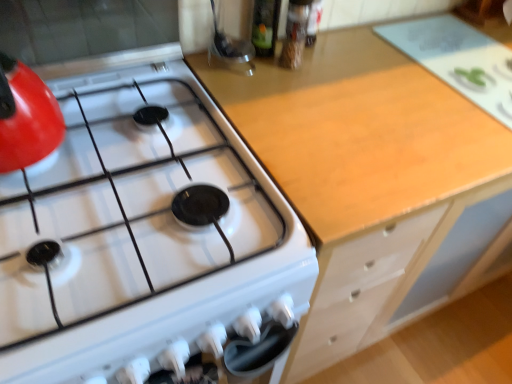
The height and width of the screenshot is (384, 512). What do you see at coordinates (373, 183) in the screenshot?
I see `light wood cabinet at center` at bounding box center [373, 183].

This screenshot has width=512, height=384. In order to click on light wood cabinet at center in this screenshot , I will do 373,183.

Locate an element on the screen. white glossy gas stove at upper left is located at coordinates [x=136, y=232].

This screenshot has height=384, width=512. Describe the element at coordinates (136, 232) in the screenshot. I see `white glossy gas stove at upper left` at that location.

Image resolution: width=512 pixels, height=384 pixels. Identify the location of light wood cabinet at center. (373, 183).

In the scene shown: Which object is positioned more to the left, white glossy gas stove at upper left or light wood cabinet at center?

white glossy gas stove at upper left.

Which object is closer to the camera, white glossy gas stove at upper left or light wood cabinet at center?

white glossy gas stove at upper left is in front.

Does point (125, 80) lie in front of point (445, 299)?

Yes, it is in front of point (445, 299).

From the image's perspective, is white glossy gas stove at upper left located above light wood cabinet at center?

Yes, from the image's perspective, white glossy gas stove at upper left is over light wood cabinet at center.

From a real-world perspective, is white glossy gas stove at upper left beneath light wood cabinet at center?

No, from a real-world perspective, white glossy gas stove at upper left is not beneath light wood cabinet at center.

In the scene shown: Considering the sizes of objects white glossy gas stove at upper left and light wood cabinet at center in the image provided, who is thinner, white glossy gas stove at upper left or light wood cabinet at center?

light wood cabinet at center.

Which of these two, white glossy gas stove at upper left or light wood cabinet at center, stands taller?

With more height is light wood cabinet at center.

Between white glossy gas stove at upper left and light wood cabinet at center, which one has smaller size?

With smaller size is white glossy gas stove at upper left.

Is white glossy gas stove at upper left spatially inside light wood cabinet at center, or outside of it?

white glossy gas stove at upper left is spatially situated outside light wood cabinet at center.

Is white glossy gas stove at upper left far away from light wood cabinet at center?

No, white glossy gas stove at upper left is not far from light wood cabinet at center.

Is white glossy gas stove at upper left facing away from light wood cabinet at center?

white glossy gas stove at upper left is not turned away from light wood cabinet at center.

From the picture: What's the angular difference between white glossy gas stove at upper left and light wood cabinet at center's facing directions?

The angular difference between white glossy gas stove at upper left and light wood cabinet at center is 1.65 degrees.

You are a GUI agent. You are given a task and a screenshot of the screen. Output one action in this format:
    pyautogui.click(x=<x>, y=<y>)
    Task: Click on the cabinetry on the right of white glossy gas stove at upper left
    Image resolution: width=512 pixels, height=384 pixels.
    Given the screenshot: What is the action you would take?
    pyautogui.click(x=373, y=183)

Is light wood cabinet at center to the left or to the right of white glossy gas stove at upper left in the image?

Clearly, light wood cabinet at center is on the right of white glossy gas stove at upper left in the image.

Considering the positions of objects light wood cabinet at center and white glossy gas stove at upper left in the image provided, who is in front, light wood cabinet at center or white glossy gas stove at upper left?

white glossy gas stove at upper left is in front.

Which is closer, (346, 186) or (63, 329)?

Point (346, 186).

From the picture: From the image's perspective, between light wood cabinet at center and white glossy gas stove at upper left, which one is located above?

A: white glossy gas stove at upper left, from the image's perspective.

In the scene shown: From a real-world perspective, is light wood cabinet at center physically below white glossy gas stove at upper left?

Yes, from a real-world perspective, light wood cabinet at center is under white glossy gas stove at upper left.

Can you confirm if light wood cabinet at center is thinner than white glossy gas stove at upper left?

Indeed, light wood cabinet at center has a lesser width compared to white glossy gas stove at upper left.

Who is taller, light wood cabinet at center or white glossy gas stove at upper left?

Standing taller between the two is light wood cabinet at center.

Does light wood cabinet at center have a smaller size compared to white glossy gas stove at upper left?

No, light wood cabinet at center is not smaller than white glossy gas stove at upper left.

Is light wood cabinet at center positioned beyond the bounds of white glossy gas stove at upper left?

Yes, light wood cabinet at center is outside of white glossy gas stove at upper left.

Would you consider light wood cabinet at center to be distant from white glossy gas stove at upper left?

light wood cabinet at center is actually quite close to white glossy gas stove at upper left.

Is light wood cabinet at center oriented away from white glossy gas stove at upper left?

No, light wood cabinet at center's orientation is not away from white glossy gas stove at upper left.

The width and height of the screenshot is (512, 384). I want to click on gas stove above the light wood cabinet at center (from a real-world perspective), so click(136, 232).

I want to click on gas stove above the light wood cabinet at center (from the image's perspective), so click(x=136, y=232).

You are a GUI agent. You are given a task and a screenshot of the screen. Output one action in this format:
    pyautogui.click(x=<x>, y=<y>)
    Task: Click on the gas stove in front of the light wood cabinet at center
    
    Given the screenshot: What is the action you would take?
    pyautogui.click(x=136, y=232)